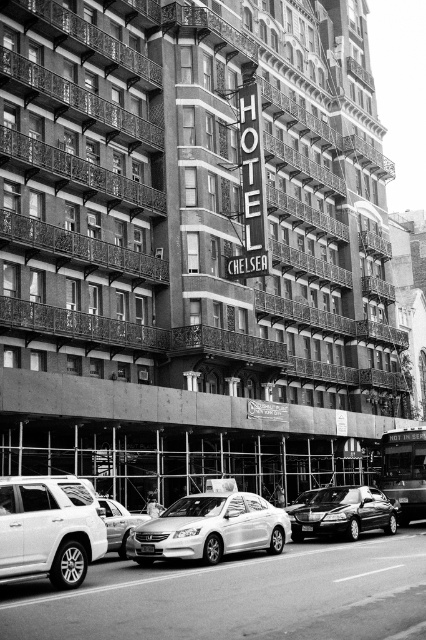
You are a delivery person needing to park your 15 feet long truck between the matte silver suv at lower left and the silver metallic sedan at center. Based on the scene, can your truck fit in the space between them?

The distance between the matte silver suv at lower left and the silver metallic sedan at center is 28.51 feet. Since your truck is 15 feet long, it can easily fit in the space between them as there is more than enough room.

You are a delivery person trying to park your delivery van between the shiny silver sedan at center and the silver metallic sedan at center. Which sedan should you move to make space?

The shiny silver sedan at center is smaller than the silver metallic sedan at center, so you should move the shiny silver sedan at center to make space for your delivery van.

You are a delivery person trying to park your 1.8 meters tall delivery cart between the shiny silver sedan at center and the shiny black sedan at center. Can your cart fit vertically between them?

The shiny silver sedan at center is taller than the shiny black sedan at center. However, the vertical space between them depends on their height difference. Since the height difference isn not specified, we cannot determine if the 1.8 meters tall delivery cart can fit vertically between them.